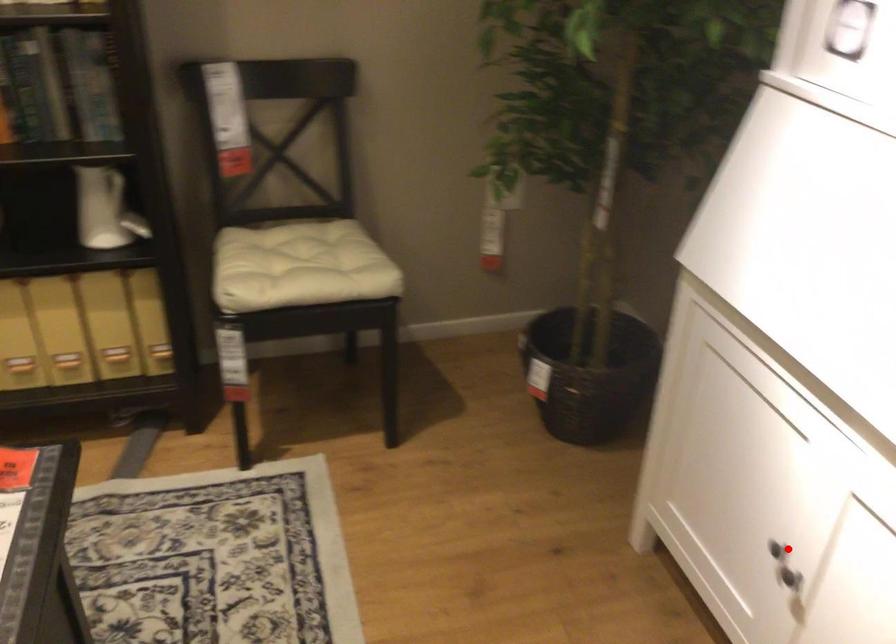
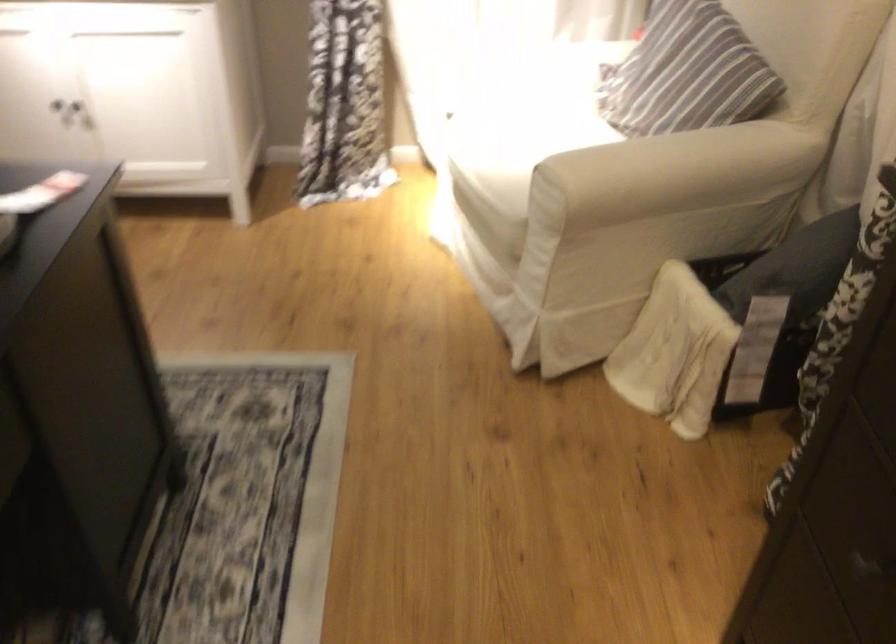
Question: I am providing you with two images of the same scene from different viewpoints. A red point is shown in image1. For the corresponding object point in image2, is it positioned nearer or farther from the camera?

Choices:
 (A) Nearer
 (B) Farther

Answer: (B)